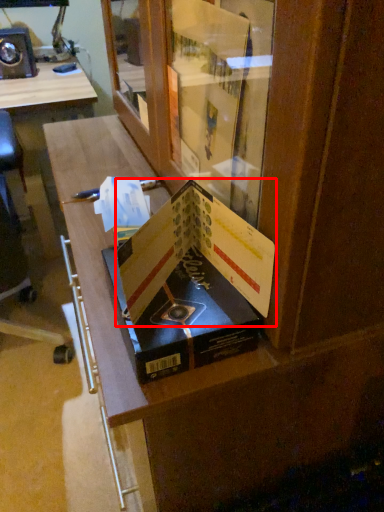
Question: From the image's perspective, what is the correct spatial positioning of paperback book (annotated by the red box) in reference to paperback book?

Choices:
 (A) above
 (B) below

Answer: (A)